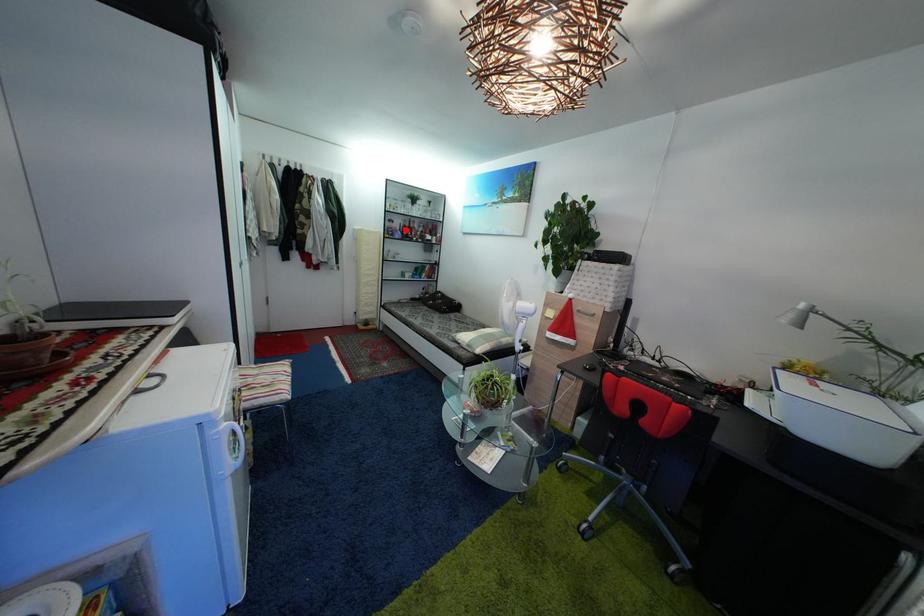
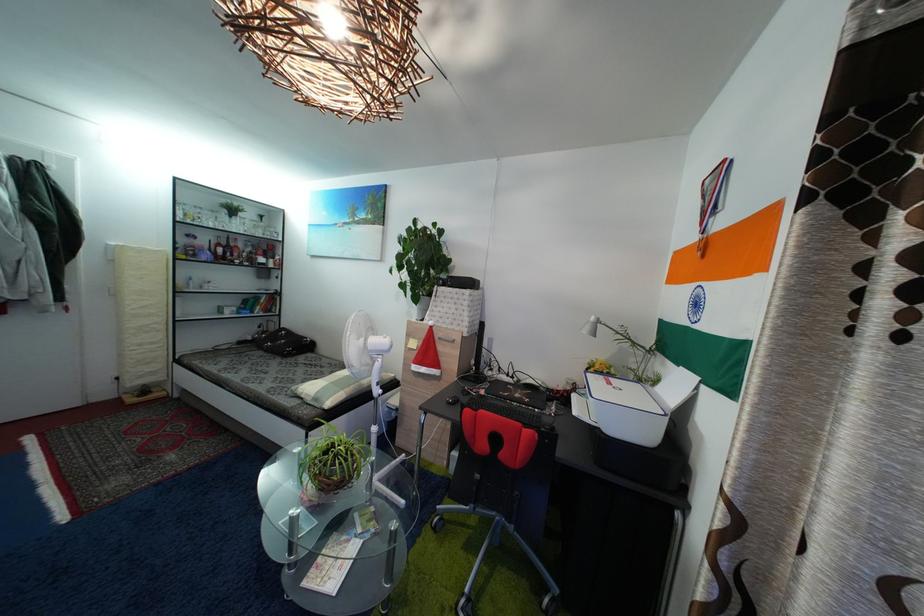
The point at the highlighted location is marked in the first image. Where is the corresponding point in the second image?

(213, 246)